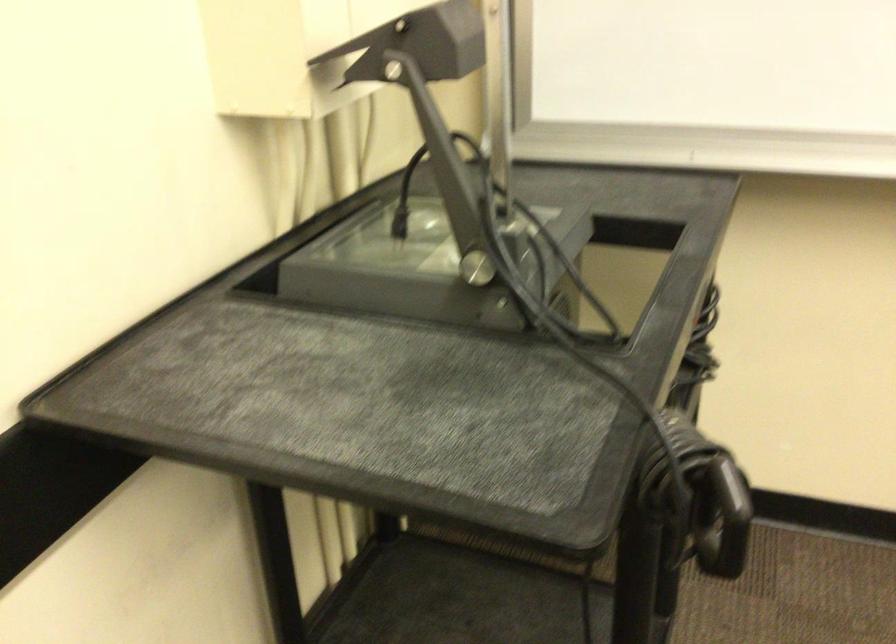
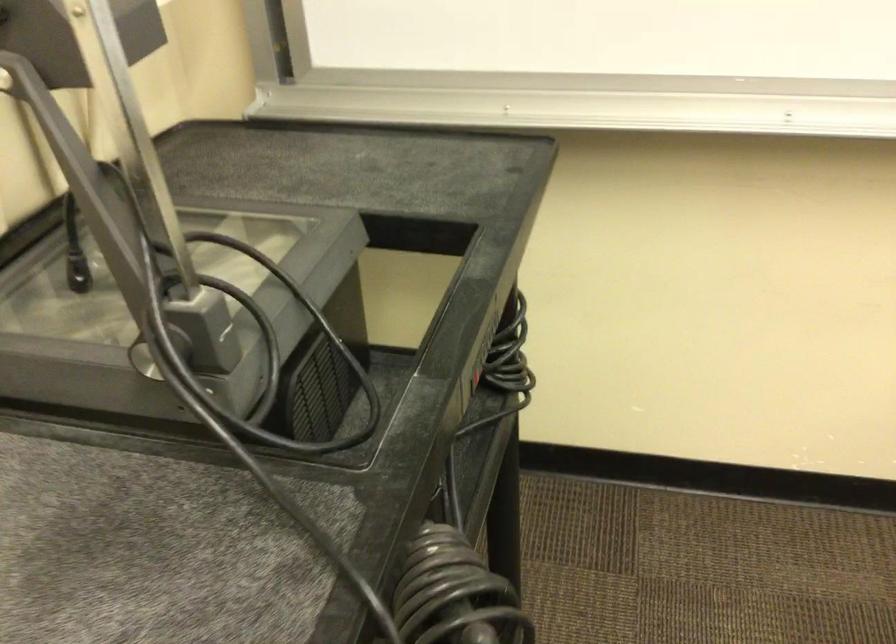
What movement of the cameraman would produce the second image?

The movement direction of the cameraman is right, forward.